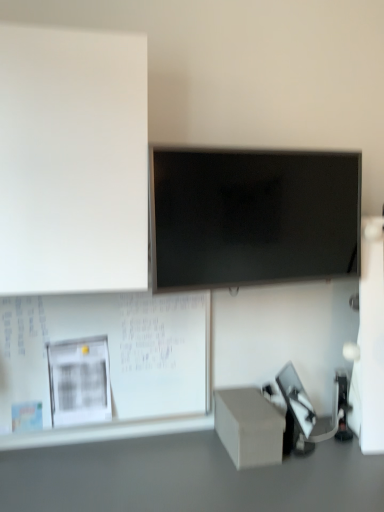
Question: From a real-world perspective, is white matte board at upper left, marked as the second bulletin board in a bottom-to-top arrangement, over smooth gray table at lower center?

Choices:
 (A) no
 (B) yes

Answer: (B)

Question: From a real-world perspective, is white matte board at upper left, marked as the second bulletin board in a bottom-to-top arrangement, located beneath smooth gray table at lower center?

Choices:
 (A) yes
 (B) no

Answer: (B)

Question: From the image's perspective, does white matte board at upper left, positioned as the first bulletin board in top-to-bottom order, appear higher than smooth gray table at lower center?

Choices:
 (A) yes
 (B) no

Answer: (A)

Question: Is white matte board at upper left, marked as the second bulletin board in a bottom-to-top arrangement, bigger than smooth gray table at lower center?

Choices:
 (A) no
 (B) yes

Answer: (A)

Question: Does white matte board at upper left, positioned as the first bulletin board in top-to-bottom order, appear on the right side of smooth gray table at lower center?

Choices:
 (A) no
 (B) yes

Answer: (A)

Question: Does white matte board at upper left, positioned as the first bulletin board in top-to-bottom order, have a smaller size compared to smooth gray table at lower center?

Choices:
 (A) no
 (B) yes

Answer: (B)

Question: Considering the relative sizes of smooth gray table at lower center and white matte bulletin board at lower left, arranged as the 1th bulletin board when ordered from the bottom, in the image provided, is smooth gray table at lower center smaller than white matte bulletin board at lower left, arranged as the 1th bulletin board when ordered from the bottom,?

Choices:
 (A) no
 (B) yes

Answer: (A)

Question: Does smooth gray table at lower center have a larger size compared to white matte bulletin board at lower left, the 2th bulletin board when ordered from top to bottom?

Choices:
 (A) no
 (B) yes

Answer: (B)

Question: Considering the relative positions of smooth gray table at lower center and white matte bulletin board at lower left, the 2th bulletin board when ordered from top to bottom, in the image provided, is smooth gray table at lower center to the right of white matte bulletin board at lower left, the 2th bulletin board when ordered from top to bottom, from the viewer's perspective?

Choices:
 (A) no
 (B) yes

Answer: (B)

Question: Is smooth gray table at lower center taller than white matte bulletin board at lower left, the 2th bulletin board when ordered from top to bottom?

Choices:
 (A) no
 (B) yes

Answer: (A)

Question: Can you confirm if smooth gray table at lower center is positioned to the left of white matte bulletin board at lower left, arranged as the 1th bulletin board when ordered from the bottom?

Choices:
 (A) yes
 (B) no

Answer: (B)

Question: From a real-world perspective, is smooth gray table at lower center physically below white matte bulletin board at lower left, the 2th bulletin board when ordered from top to bottom?

Choices:
 (A) yes
 (B) no

Answer: (A)

Question: From the image's perspective, is matte black screen at center over white matte bulletin board at lower left, the 2th bulletin board when ordered from top to bottom?

Choices:
 (A) yes
 (B) no

Answer: (A)